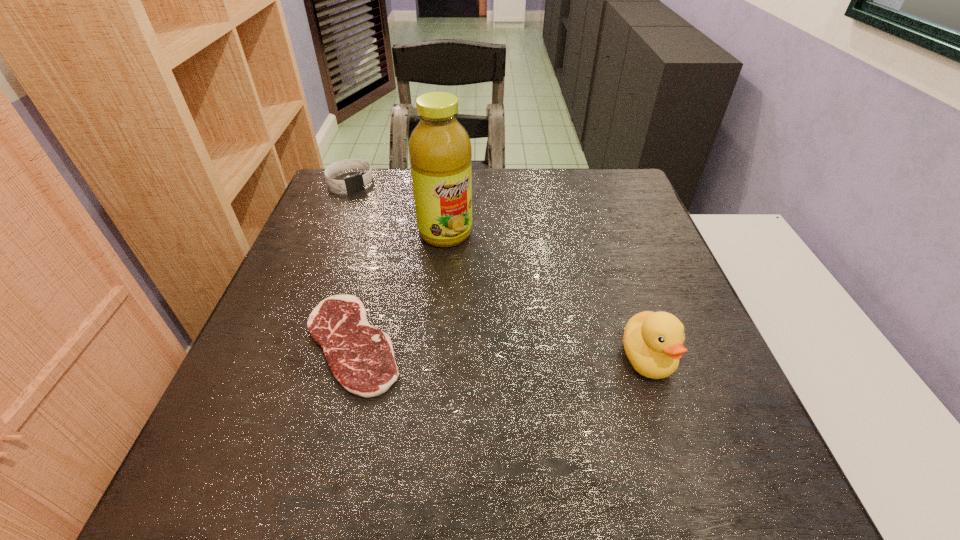
Where is `steak`? The image size is (960, 540). steak is located at coordinates (361, 357).

This screenshot has width=960, height=540. I want to click on the rightmost object, so click(x=653, y=341).

Where is `the second tallest object`? the second tallest object is located at coordinates point(653,341).

The height and width of the screenshot is (540, 960). I want to click on fruit juice, so click(439, 148).

I want to click on the second farthest object, so click(439, 148).

The image size is (960, 540). I want to click on the second shortest object, so click(356, 182).

At what (x,y) coordinates should I click in order to perform the action: click on wristband. Please return your answer as a coordinate pair (x, y). The height and width of the screenshot is (540, 960). Looking at the image, I should click on (356, 182).

Locate an element on the screen. blank space located 0.060m on the front of the steak is located at coordinates (330, 431).

Where is `free space located 0.070m on the face of the second tallest object`? The image size is (960, 540). free space located 0.070m on the face of the second tallest object is located at coordinates (670, 425).

Where is `vacant area situated 0.070m on the front label of the tallest object`? vacant area situated 0.070m on the front label of the tallest object is located at coordinates (469, 266).